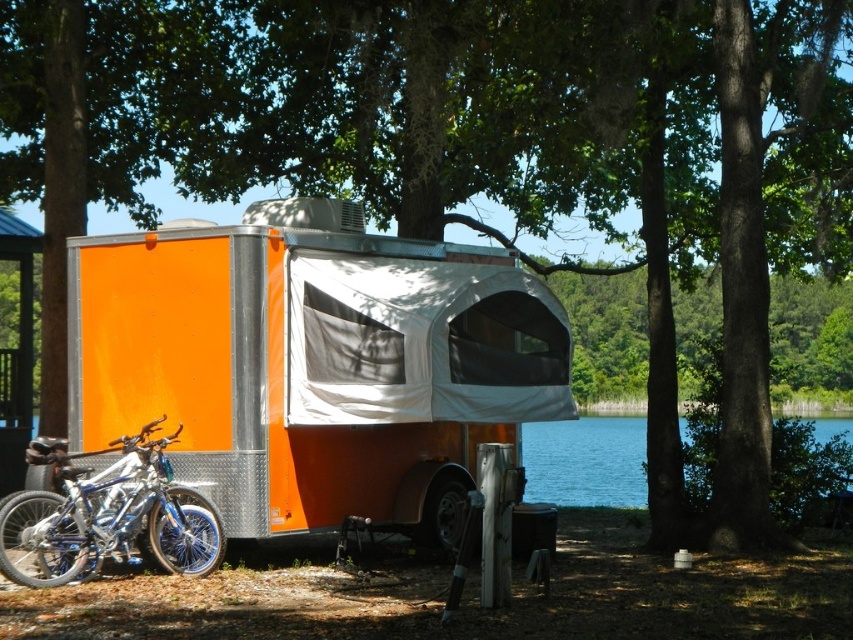
Question: Can you confirm if orange metallic camper at center is wider than shiny blue metallic bicycle at lower left?

Choices:
 (A) no
 (B) yes

Answer: (B)

Question: Does orange metallic camper at center have a larger size compared to shiny blue metallic bicycle at lower left?

Choices:
 (A) no
 (B) yes

Answer: (B)

Question: Which point appears closest to the camera in this image?

Choices:
 (A) (602, 464)
 (B) (172, 476)
 (C) (273, 440)

Answer: (B)

Question: Which of the following is the farthest from the observer?

Choices:
 (A) (405, 285)
 (B) (131, 525)

Answer: (A)

Question: Which point is closer to the camera taking this photo?

Choices:
 (A) (15, 536)
 (B) (492, 346)

Answer: (A)

Question: Does orange metallic camper at center appear under blue water at lower center?

Choices:
 (A) yes
 (B) no

Answer: (B)